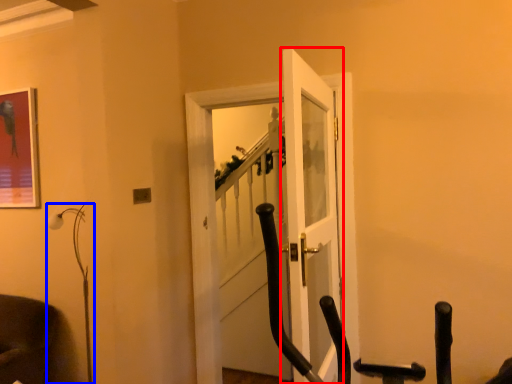
Question: Which of the following is the farthest to the observer, door (highlighted by a red box) or lamp (highlighted by a blue box)?

Choices:
 (A) door
 (B) lamp

Answer: (B)